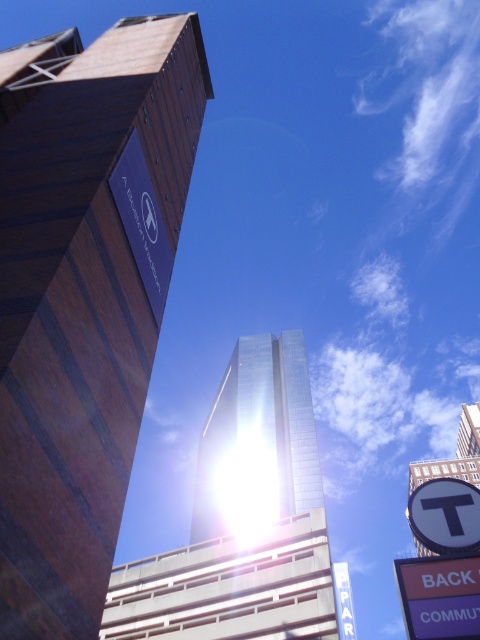
Question: Can you confirm if glossy metallic skyscraper at center is bigger than purple plastic sign at lower right?

Choices:
 (A) no
 (B) yes

Answer: (B)

Question: Estimate the real-world distances between objects in this image. Which object is closer to the white plastic sign at lower right?

Choices:
 (A) purple plastic sign at lower right
 (B) glossy glass tower at center
 (C) glossy metallic skyscraper at center
 (D) brown wood tower at upper left

Answer: (A)

Question: Is purple plastic sign at lower right thinner than white plastic sign at lower right?

Choices:
 (A) yes
 (B) no

Answer: (B)

Question: Can you confirm if brown wood tower at upper left is positioned to the left of purple plastic sign at lower right?

Choices:
 (A) no
 (B) yes

Answer: (B)

Question: Which point appears farthest from the camera in this image?

Choices:
 (A) (444, 490)
 (B) (432, 557)
 (C) (51, 548)

Answer: (A)

Question: Which point appears closest to the camera in this image?

Choices:
 (A) (248, 416)
 (B) (464, 534)

Answer: (B)